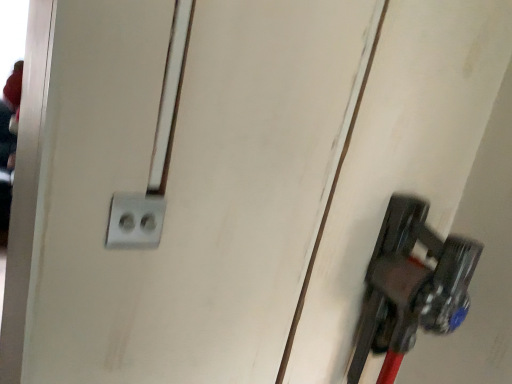
Describe the element at coordinates (411, 287) in the screenshot. I see `metallic dark gray door handle at right` at that location.

You are a GUI agent. You are given a task and a screenshot of the screen. Output one action in this format:
    pyautogui.click(x=<x>, y=<y>)
    Task: Click on the metallic dark gray door handle at right
    This screenshot has width=512, height=384.
    Given the screenshot: What is the action you would take?
    pos(411,287)

Measure the distance between metallic dark gray door handle at right and camera.

metallic dark gray door handle at right is 33.83 inches away from camera.

This screenshot has width=512, height=384. In order to click on metallic dark gray door handle at right in this screenshot , I will do `click(411, 287)`.